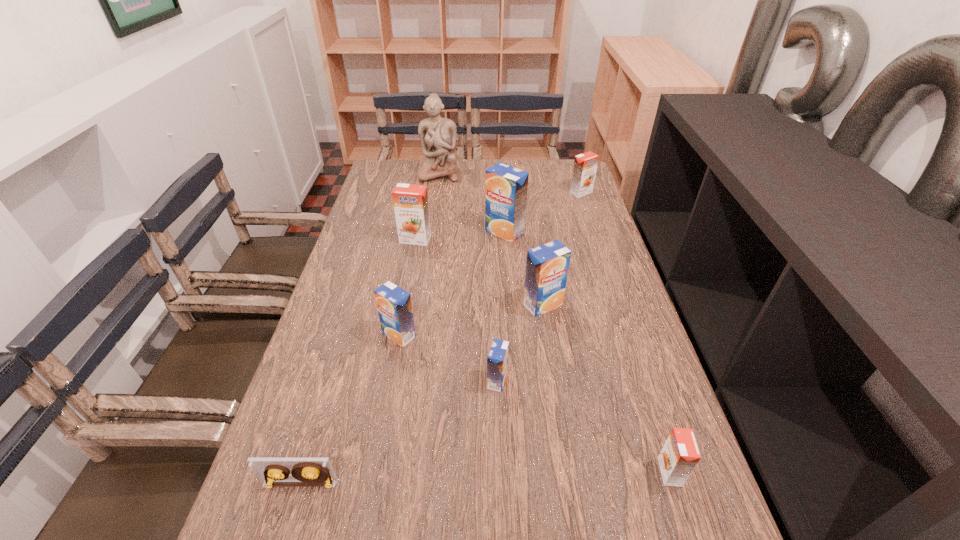
Locate an element on the screen. Image resolution: width=960 pixels, height=540 pixels. vacant region located 0.340m on the front of the third smallest blue orange_juice is located at coordinates (564, 441).

You are a GUI agent. You are given a task and a screenshot of the screen. Output one action in this format:
    pyautogui.click(x=<x>, y=<y>)
    Task: Click on the vacant space located 0.070m on the front of the leftmost orange orange juice
    This screenshot has height=540, width=960.
    Given the screenshot: What is the action you would take?
    pyautogui.click(x=412, y=260)

Where is `free space located 0.080m on the left of the farthest orange orange juice`? Image resolution: width=960 pixels, height=540 pixels. free space located 0.080m on the left of the farthest orange orange juice is located at coordinates (547, 193).

This screenshot has height=540, width=960. In order to click on free point located on the front of the second nearest blue orange_juice in this screenshot , I will do `click(394, 368)`.

The height and width of the screenshot is (540, 960). I want to click on blank space located on the right of the third nearest object, so click(x=615, y=381).

Locate an element on the screen. This screenshot has width=960, height=540. vacant position located on the back of the nearest orange juice is located at coordinates (628, 342).

Find the location of `figurine present at the far edge`. figurine present at the far edge is located at coordinates (437, 135).

Locate an element on the screen. The width and height of the screenshot is (960, 540). orange juice that is at the far edge is located at coordinates tap(585, 165).

The height and width of the screenshot is (540, 960). Find the location of `orange juice at the left edge`. orange juice at the left edge is located at coordinates (410, 201).

Where is `videotape that is at the left edge`? This screenshot has width=960, height=540. videotape that is at the left edge is located at coordinates (271, 472).